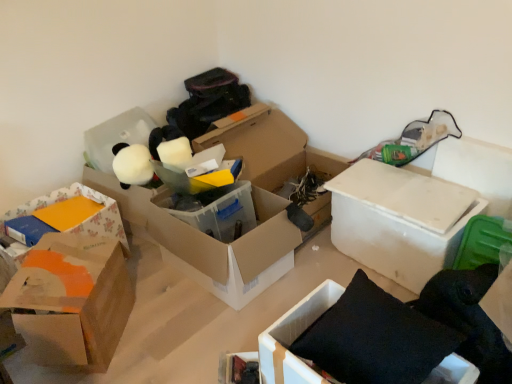
Question: Is white cardboard box at center-right, the fifth box when ordered from left to right, to the left of floral paper box at left, which is the first box in left-to-right order, from the viewer's perspective?

Choices:
 (A) yes
 (B) no

Answer: (B)

Question: Is white cardboard box at center-right, the first box in the right-to-left sequence, shorter than floral paper box at left, which is the first box in left-to-right order?

Choices:
 (A) yes
 (B) no

Answer: (B)

Question: Does white cardboard box at center-right, the first box in the right-to-left sequence, have a greater height compared to floral paper box at left, marked as the 5th box in a right-to-left arrangement?

Choices:
 (A) no
 (B) yes

Answer: (B)

Question: Is white cardboard box at center-right, the first box in the right-to-left sequence, far away from floral paper box at left, marked as the 5th box in a right-to-left arrangement?

Choices:
 (A) no
 (B) yes

Answer: (B)

Question: Considering the relative sizes of white cardboard box at center-right, the first box in the right-to-left sequence, and floral paper box at left, which is the first box in left-to-right order, in the image provided, is white cardboard box at center-right, the first box in the right-to-left sequence, thinner than floral paper box at left, which is the first box in left-to-right order,?

Choices:
 (A) yes
 (B) no

Answer: (A)

Question: Do you think orange cardboard box at left, the second box in the left-to-right sequence, is within matte black book at lower center, the first storage box viewed from the front, or outside of it?

Choices:
 (A) inside
 (B) outside

Answer: (B)

Question: Considering their positions, is orange cardboard box at left, the second box in the left-to-right sequence, located in front of or behind matte black book at lower center, the 2th storage box from the top?

Choices:
 (A) front
 (B) behind

Answer: (A)

Question: Considering the positions of point (89, 249) and point (246, 382), is point (89, 249) closer or farther from the camera than point (246, 382)?

Choices:
 (A) farther
 (B) closer

Answer: (A)

Question: Would you say orange cardboard box at left, the second box in the left-to-right sequence, is to the left or to the right of matte black book at lower center, the first storage box ordered from the bottom, in the picture?

Choices:
 (A) right
 (B) left

Answer: (B)

Question: Looking at the image, does orange cardboard box at left, the second box in the left-to-right sequence, seem bigger or smaller compared to translucent plastic box at center, placed as the 3th box when sorted from right to left?

Choices:
 (A) small
 (B) big

Answer: (A)

Question: In terms of width, does orange cardboard box at left, the second box in the left-to-right sequence, look wider or thinner when compared to translucent plastic box at center, placed as the third box when sorted from left to right?

Choices:
 (A) thin
 (B) wide

Answer: (A)

Question: From a real-world perspective, is orange cardboard box at left, which appears as the 4th box when viewed from the right, positioned above or below translucent plastic box at center, placed as the third box when sorted from left to right?

Choices:
 (A) below
 (B) above

Answer: (B)

Question: In the image, is orange cardboard box at left, which appears as the 4th box when viewed from the right, on the left side or the right side of translucent plastic box at center, placed as the third box when sorted from left to right?

Choices:
 (A) right
 (B) left

Answer: (B)

Question: Looking at the image, does translucent plastic box at center, placed as the 3th box when sorted from right to left, seem bigger or smaller compared to orange cardboard box at left, the second box in the left-to-right sequence?

Choices:
 (A) big
 (B) small

Answer: (A)

Question: Considering the relative positions of translucent plastic box at center, placed as the 3th box when sorted from right to left, and orange cardboard box at left, the second box in the left-to-right sequence, in the image provided, is translucent plastic box at center, placed as the 3th box when sorted from right to left, to the left or to the right of orange cardboard box at left, the second box in the left-to-right sequence,?

Choices:
 (A) left
 (B) right

Answer: (B)